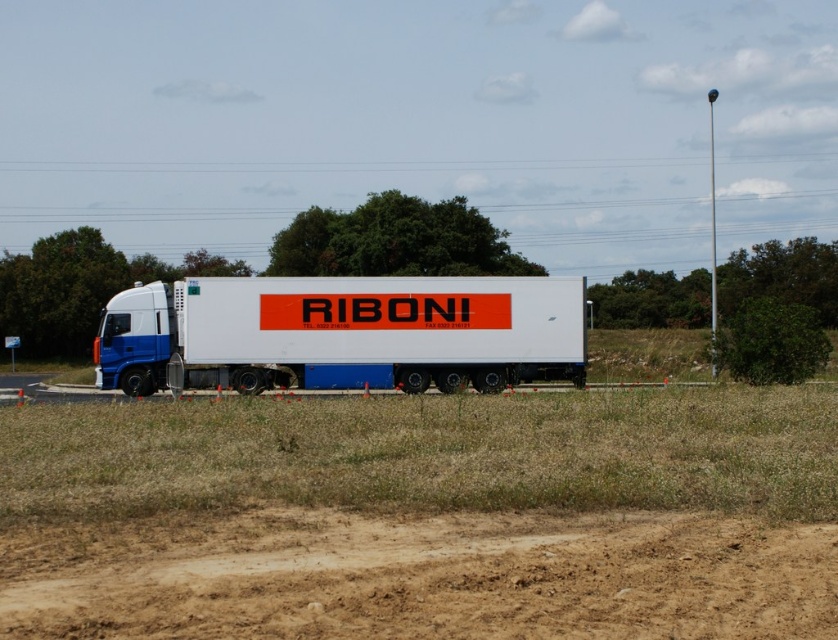
You are a delivery driver who needs to turn around the white matte trailer truck at center. There is a brown sandy dirt track at lower center available for maneuvering. Based on the space provided, do you think the truck can make a U turn here?

The brown sandy dirt track at lower center occupies less space than the white matte trailer truck at center, so the truck cannot make a U turn here due to insufficient space.

You are standing at the point with coordinates point (255, 342) and want to walk towards the semi truck parked on the side of the road. Is the point (740, 566) located in front of or behind you relative to your direction of travel?

The point (740, 566) is in front of point (255, 342), so when walking towards the semi truck, the point (740, 566) would be in front of you relative to your direction of travel.